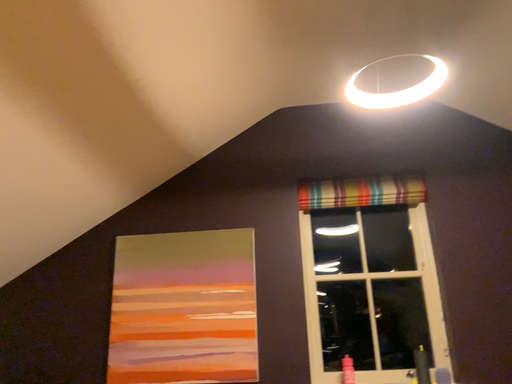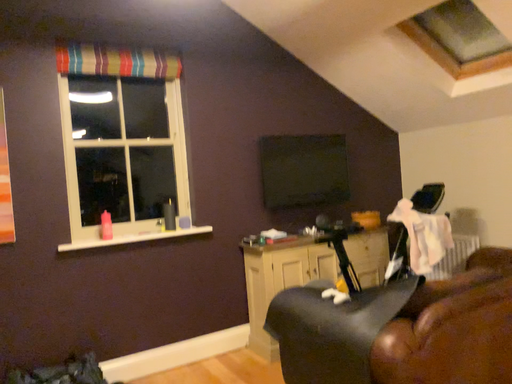
Question: Which way did the camera rotate in the video?

Choices:
 (A) rotated right
 (B) rotated left

Answer: (A)